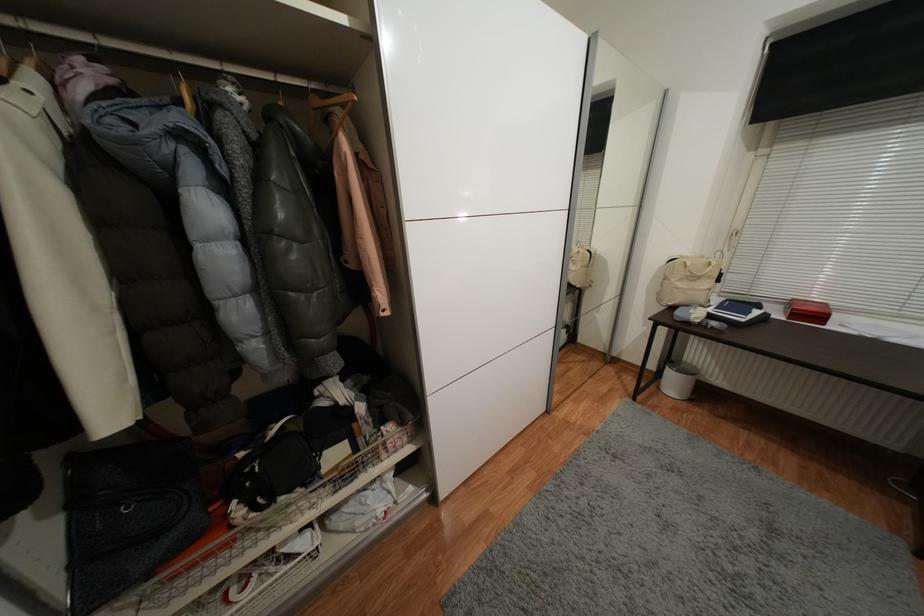
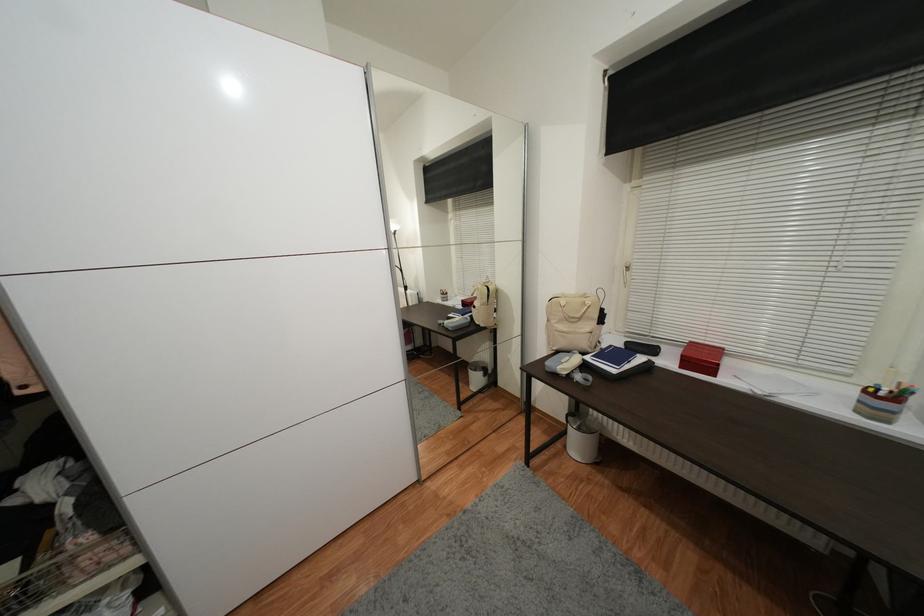
Question: Which direction would the cameraman need to move to produce the second image? Reply with the corresponding letter.

Choices:
 (A) Left
 (B) Right
 (C) Forward
 (D) Backward

Answer: (B)